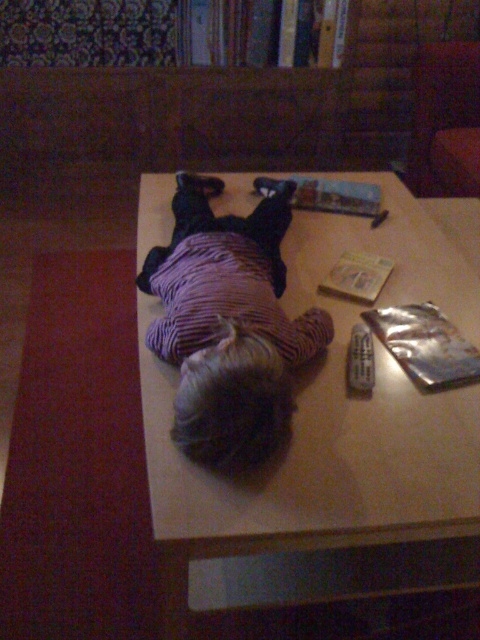
Is purple corduroy shirt at center closer to the viewer compared to black plastic remote at center?

Yes, purple corduroy shirt at center is closer to the viewer.

Can you confirm if purple corduroy shirt at center is positioned to the left of black plastic remote at center?

Yes, purple corduroy shirt at center is to the left of black plastic remote at center.

Which is in front, point (204, 305) or point (373, 358)?

Positioned in front is point (204, 305).

Locate an element on the screen. This screenshot has height=640, width=480. purple corduroy shirt at center is located at coordinates (228, 324).

Consider the image. Does red carpet at lower left have a lesser width compared to black plastic remote at center?

No, red carpet at lower left is not thinner than black plastic remote at center.

Is point (82, 394) closer to viewer compared to point (348, 369)?

No, (82, 394) is further to viewer.

Where is `red carpet at lower left`? The image size is (480, 640). red carpet at lower left is located at coordinates (79, 461).

Is wooden table at center smaller than red carpet at lower left?

Incorrect, wooden table at center is not smaller in size than red carpet at lower left.

Find the location of a particular element. wooden table at center is located at coordinates (336, 438).